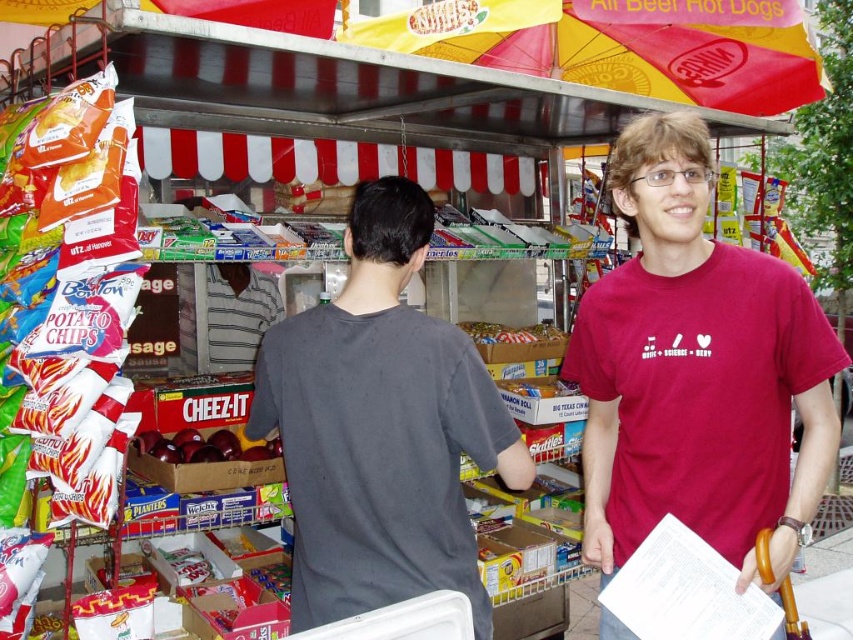
Locate an element on the screen. Image resolution: width=853 pixels, height=640 pixels. dark gray t-shirt at center is located at coordinates (380, 428).

Measure the distance between point (434, 524) and camera.

Point (434, 524) is 6.66 feet away from camera.

Between point (294, 550) and point (143, 444), which one is positioned in front?

Point (294, 550) is in front.

Where is `dark gray t-shirt at center`? Image resolution: width=853 pixels, height=640 pixels. dark gray t-shirt at center is located at coordinates (380, 428).

Can you confirm if red fabric umbrella at upper center is thinner than yellow cardboard box at center?

No, red fabric umbrella at upper center is not thinner than yellow cardboard box at center.

Which is behind, point (566, 64) or point (525, 381)?

The point (566, 64) is more distant.

At what (x,y) coordinates should I click in order to perform the action: click on red fabric umbrella at upper center. Please return your answer as a coordinate pair (x, y). Looking at the image, I should click on coord(624,45).

From the picture: Between dark gray t-shirt at center and matte brown candy at center, which one appears on the left side from the viewer's perspective?

Positioned to the left is dark gray t-shirt at center.

Does dark gray t-shirt at center have a greater height compared to matte brown candy at center?

Indeed, dark gray t-shirt at center has a greater height compared to matte brown candy at center.

Which is behind, point (442, 340) or point (473, 323)?

The point (473, 323) is behind.

At what (x,y) coordinates should I click in order to perform the action: click on dark gray t-shirt at center. Please return your answer as a coordinate pair (x, y). This screenshot has height=640, width=853. Looking at the image, I should click on (380, 428).